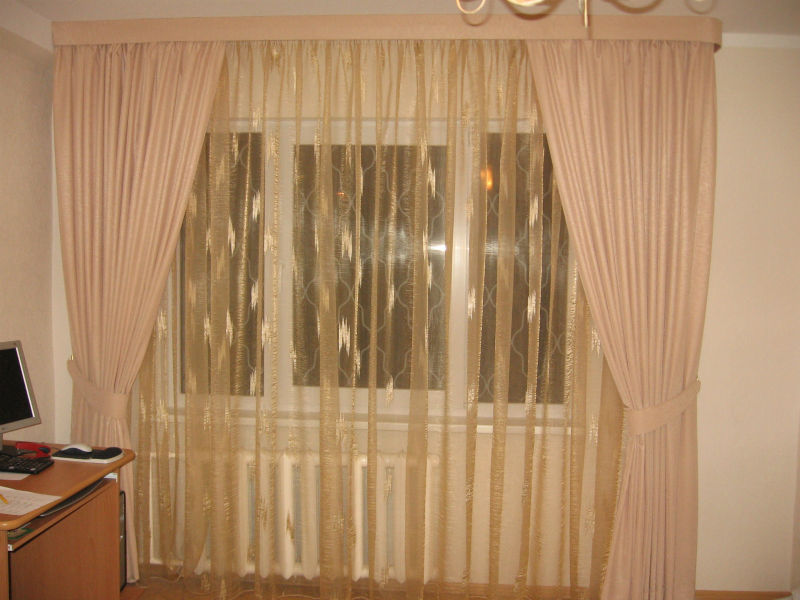
Identify the location of white radiator behind curtains. The height and width of the screenshot is (600, 800). (284, 500), (365, 508), (188, 490).